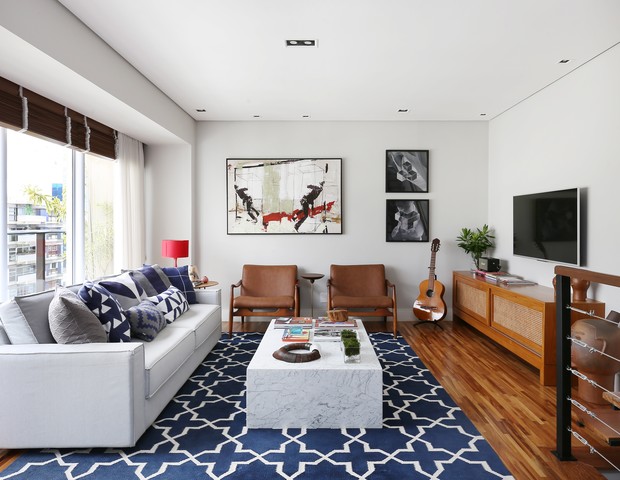
I want to click on pictures, so click(x=311, y=199).